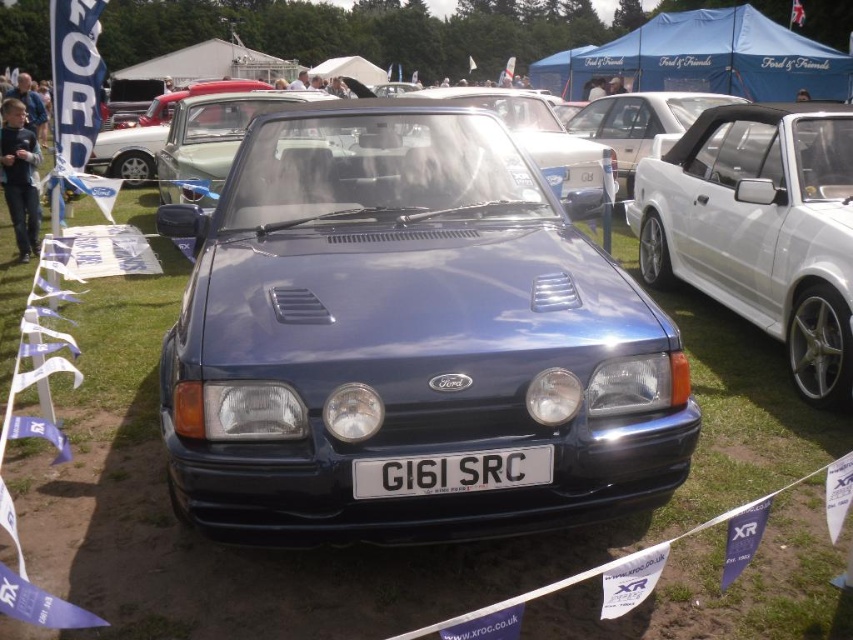
You are a photographer at the car show and need to capture both the white metallic sedan at right and the black plastic license plate at center in a single frame. Which object should you focus on first to ensure both are in the shot?

The white metallic sedan at right is larger in size than the black plastic license plate at center, so you should focus on the white metallic sedan at right first to ensure both are in the shot.

You are a photographer at the car show and want to capture both the glossy blue car at center and the white metallic sedan at right in a single shot. Based on their positions, which car should you position closer to the left side of your camera frame to include both?

To include both the glossy blue car at center and the white metallic sedan at right in a single shot, you should position the glossy blue car at center closer to the left side of your camera frame since it is already to the left of the white metallic sedan at right.

You are a photographer trying to capture the white metallic sedan at right and the black plastic license plate at center in the same frame. Since you want to ensure both are fully visible, which object should you adjust your camera angle to focus on first to account for its larger size?

The white metallic sedan at right is wider than the black plastic license plate at center, so you should focus on capturing the white metallic sedan at right first to accommodate its larger width.